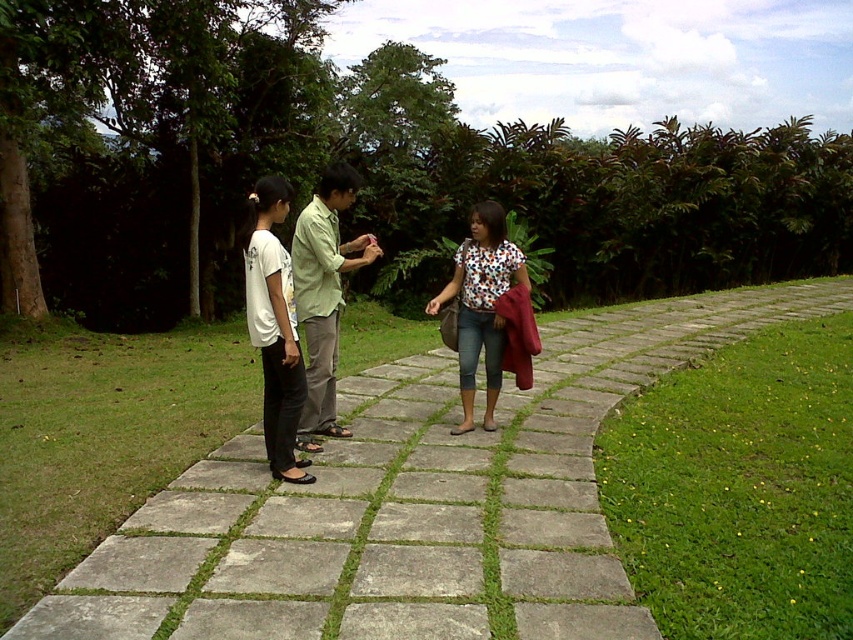
Who is positioned more to the right, matte green shirt at center or white matte shirt at center?

matte green shirt at center is more to the right.

Does point (299, 476) come behind point (253, 317)?

Yes.

I want to click on matte green shirt at center, so click(300, 310).

How distant is green grass at lower right from green matte shirt at center?

The distance of green grass at lower right from green matte shirt at center is 3.59 meters.

Which is in front, point (796, 568) or point (316, 212)?

Positioned in front is point (796, 568).

Between point (708, 464) and point (318, 241), which one is positioned behind?

The point (708, 464) is more distant.

You are a GUI agent. You are given a task and a screenshot of the screen. Output one action in this format:
    pyautogui.click(x=<x>, y=<y>)
    Task: Click on the green grass at lower right
    Image resolution: width=853 pixels, height=640 pixels.
    Given the screenshot: What is the action you would take?
    pyautogui.click(x=740, y=486)

Does point (302, 259) come in front of point (424, 308)?

Yes, it is in front of point (424, 308).

Can you confirm if green matte shirt at center is thinner than floral shirt at center?

Indeed, green matte shirt at center has a lesser width compared to floral shirt at center.

Identify the location of green matte shirt at center. This screenshot has height=640, width=853. (323, 294).